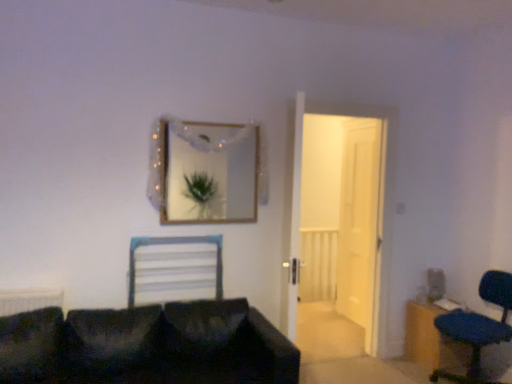
Identify the location of white plastic chair at center. (174, 243).

The height and width of the screenshot is (384, 512). What do you see at coordinates (349, 203) in the screenshot? I see `white glossy door at center, the second door when ordered from back to front` at bounding box center [349, 203].

The width and height of the screenshot is (512, 384). In order to click on white wooden door at center, the 2th door from the front in this screenshot , I will do `click(358, 219)`.

The image size is (512, 384). What are the coordinates of `wooden dresser at lower right` in the screenshot? It's located at (422, 334).

Find the location of a particular element. The width and height of the screenshot is (512, 384). gold-framed mirror at upper center is located at coordinates (210, 180).

From the picture: From a real-world perspective, which is physically above, white wooden door at center, the 1th door from the back, or wooden dresser at lower right?

white wooden door at center, the 1th door from the back, is physically above.

Can you tell me how much white wooden door at center, the 1th door from the back, and wooden dresser at lower right differ in facing direction?

They differ by 89.2 degrees in their facing directions.

Is white wooden door at center, the 1th door from the back, oriented away from wooden dresser at lower right?

That's not correct — white wooden door at center, the 1th door from the back, is not looking away from wooden dresser at lower right.

Is there a large distance between blue fabric chair at lower right and white glossy door at center, the second door when ordered from back to front?

Yes, blue fabric chair at lower right and white glossy door at center, the second door when ordered from back to front, are located far from each other.

Based on their sizes in the image, would you say blue fabric chair at lower right is bigger or smaller than white glossy door at center, the second door when ordered from back to front?

In the image, blue fabric chair at lower right appears to be larger than white glossy door at center, the second door when ordered from back to front.

Which point is more distant from viewer, (486, 277) or (358, 230)?

Point (358, 230)

Considering the relative positions of blue fabric chair at lower right and white glossy door at center, which is the 1th door in front-to-back order, in the image provided, is blue fabric chair at lower right to the left or to the right of white glossy door at center, which is the 1th door in front-to-back order,?

blue fabric chair at lower right is to the right of white glossy door at center, which is the 1th door in front-to-back order.

From the image's perspective, does white plastic chair at center appear lower than white wooden door at center, the 1th door from the back?

Correct, white plastic chair at center appears lower than white wooden door at center, the 1th door from the back, in the image.

From a real-world perspective, which object stands above the other?

In real-world perspective, white wooden door at center, the 2th door from the front, is above.

Looking at this image, is white plastic chair at center smaller than white wooden door at center, the 1th door from the back?

Correct, white plastic chair at center occupies less space than white wooden door at center, the 1th door from the back.

Find the location of a particular element. computer chair below the white wooden door at center, the 1th door from the back (from a real-world perspective) is located at coordinates (174, 243).

Which is behind, gold-framed mirror at upper center or white plastic chair at center?

gold-framed mirror at upper center is more distant.

Is point (180, 147) closer to viewer compared to point (221, 280)?

Yes, it is.

In terms of size, does gold-framed mirror at upper center appear bigger or smaller than white plastic chair at center?

Considering their sizes, gold-framed mirror at upper center takes up less space than white plastic chair at center.

From the picture: What's the angular difference between gold-framed mirror at upper center and white plastic chair at center's facing directions?

gold-framed mirror at upper center and white plastic chair at center are facing 1.1 degrees away from each other.

Which object is wider, white wooden door at center, the 2th door from the front, or gold-framed mirror at upper center?

gold-framed mirror at upper center is wider.

Considering the sizes of objects white wooden door at center, the 2th door from the front, and gold-framed mirror at upper center in the image provided, who is taller, white wooden door at center, the 2th door from the front, or gold-framed mirror at upper center?

white wooden door at center, the 2th door from the front.

Is white wooden door at center, the 1th door from the back, not inside gold-framed mirror at upper center?

That's correct, white wooden door at center, the 1th door from the back, is outside of gold-framed mirror at upper center.

Is white wooden door at center, the 1th door from the back, to the right of gold-framed mirror at upper center from the viewer's perspective?

Yes, white wooden door at center, the 1th door from the back, is to the right of gold-framed mirror at upper center.

From the picture: From a real-world perspective, is white plastic chair at center located higher than gold-framed mirror at upper center?

No, from a real-world perspective, white plastic chair at center is not over gold-framed mirror at upper center

Can you see white plastic chair at center touching gold-framed mirror at upper center?

No.

Does white plastic chair at center have a greater height compared to gold-framed mirror at upper center?

No, white plastic chair at center is not taller than gold-framed mirror at upper center.

You are a GUI agent. You are given a task and a screenshot of the screen. Output one action in this format:
    pyautogui.click(x=<x>, y=<y>)
    Task: Click on the mirror behind the white plastic chair at center
    Image resolution: width=512 pixels, height=384 pixels.
    Given the screenshot: What is the action you would take?
    pyautogui.click(x=210, y=180)

Is white glossy door at center, which is the 1th door in front-to-back order, inside the boundaries of white wooden door at center, the 2th door from the front, or outside?

white glossy door at center, which is the 1th door in front-to-back order, is spatially situated outside white wooden door at center, the 2th door from the front.

Does white glossy door at center, the second door when ordered from back to front, have a greater height compared to white wooden door at center, the 1th door from the back?

No, white glossy door at center, the second door when ordered from back to front, is not taller than white wooden door at center, the 1th door from the back.

Considering the sizes of objects white glossy door at center, which is the 1th door in front-to-back order, and white wooden door at center, the 2th door from the front, in the image provided, who is wider, white glossy door at center, which is the 1th door in front-to-back order, or white wooden door at center, the 2th door from the front,?

white glossy door at center, which is the 1th door in front-to-back order, is wider.

Between white glossy door at center, which is the 1th door in front-to-back order, and white wooden door at center, the 1th door from the back, which one is positioned behind?

white wooden door at center, the 1th door from the back, is further away from the camera.

Where is `dresser on the right of white wooden door at center, the 2th door from the front`? This screenshot has height=384, width=512. dresser on the right of white wooden door at center, the 2th door from the front is located at coordinates (422, 334).

Where is `chair that appears below the white glossy door at center, the second door when ordered from back to front (from the image's perspective)`? This screenshot has height=384, width=512. chair that appears below the white glossy door at center, the second door when ordered from back to front (from the image's perspective) is located at coordinates (478, 326).

Considering their positions, is blue fabric chair at lower right positioned closer to wooden dresser at lower right than white wooden door at center, the 1th door from the back?

blue fabric chair at lower right is positioned closer to the anchor wooden dresser at lower right.

From the image, which object appears to be nearer to white plastic chair at center, white glossy door at center, which is the 1th door in front-to-back order, or gold-framed mirror at upper center?

Based on the image, gold-framed mirror at upper center appears to be nearer to white plastic chair at center.

Based on their spatial positions, is white plastic chair at center or wooden dresser at lower right further from white glossy door at center, which is the 1th door in front-to-back order?

white plastic chair at center.

Considering their positions, is blue fabric chair at lower right positioned further to black fabric couch at lower left than wooden dresser at lower right?

Among the two, wooden dresser at lower right is located further to black fabric couch at lower left.

Which object lies nearer to the anchor point translucent plastic curtain at upper center, blue fabric chair at lower right or white wooden door at center, the 2th door from the front?

Among the two, white wooden door at center, the 2th door from the front, is located nearer to translucent plastic curtain at upper center.

From the image, which object appears to be nearer to translucent plastic curtain at upper center, white glossy door at center, the second door when ordered from back to front, or white wooden door at center, the 2th door from the front?

Based on the image, white glossy door at center, the second door when ordered from back to front, appears to be nearer to translucent plastic curtain at upper center.

When comparing their distances from white glossy door at center, the second door when ordered from back to front, does gold-framed mirror at upper center or black fabric couch at lower left seem closer?

gold-framed mirror at upper center is closer to white glossy door at center, the second door when ordered from back to front.

In the scene shown: When comparing their distances from white glossy door at center, the second door when ordered from back to front, does translucent plastic curtain at upper center or wooden dresser at lower right seem further?

Based on the image, translucent plastic curtain at upper center appears to be further to white glossy door at center, the second door when ordered from back to front.

In order to click on computer chair positioned between black fabric couch at lower left and white glossy door at center, the second door when ordered from back to front, from near to far in this screenshot , I will do `click(174, 243)`.

Image resolution: width=512 pixels, height=384 pixels. Identify the location of mirror between translucent plastic curtain at upper center and white glossy door at center, which is the 1th door in front-to-back order. (210, 180).

Where is `mirror positioned between black fabric couch at lower left and white wooden door at center, the 2th door from the front, from near to far`? The height and width of the screenshot is (384, 512). mirror positioned between black fabric couch at lower left and white wooden door at center, the 2th door from the front, from near to far is located at coordinates (210, 180).

The image size is (512, 384). I want to click on computer chair between black fabric couch at lower left and translucent plastic curtain at upper center in the front-back direction, so click(174, 243).